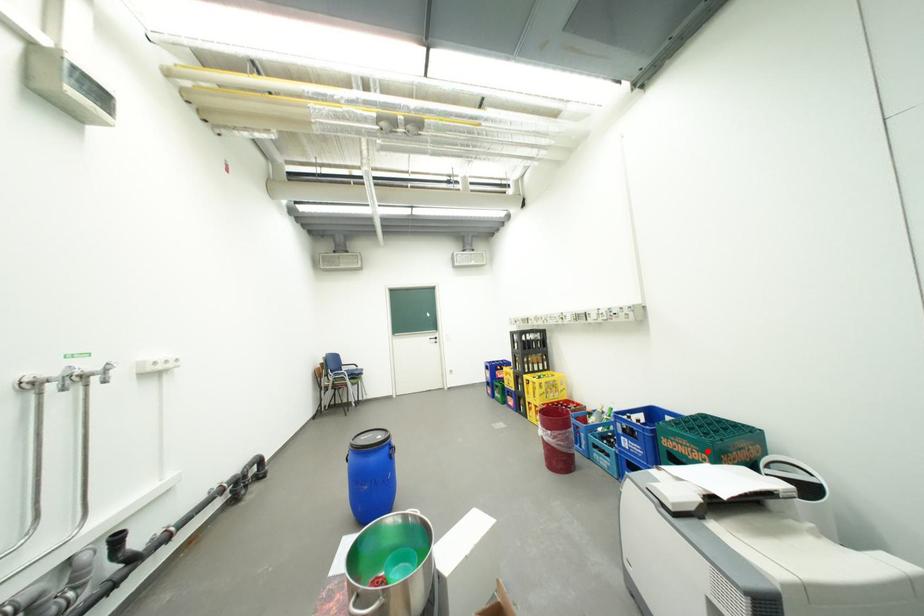
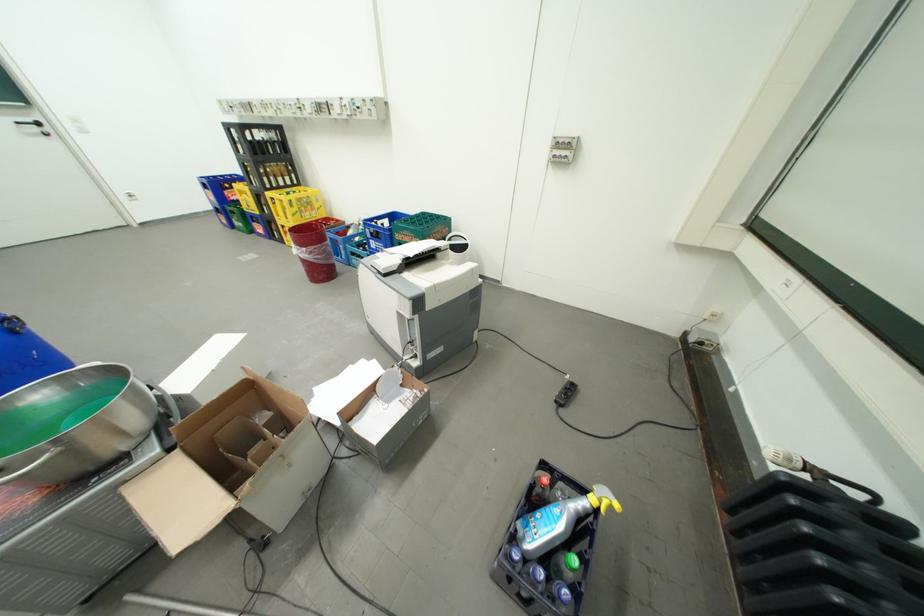
In the second image, find the point that corresponds to the highlighted location in the first image.

(424, 238)